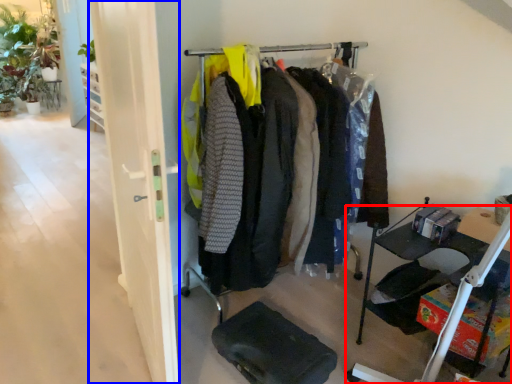
Question: Which object is closer to the camera taking this photo, furniture (highlighted by a red box) or glass door (highlighted by a blue box)?

Choices:
 (A) furniture
 (B) glass door

Answer: (B)